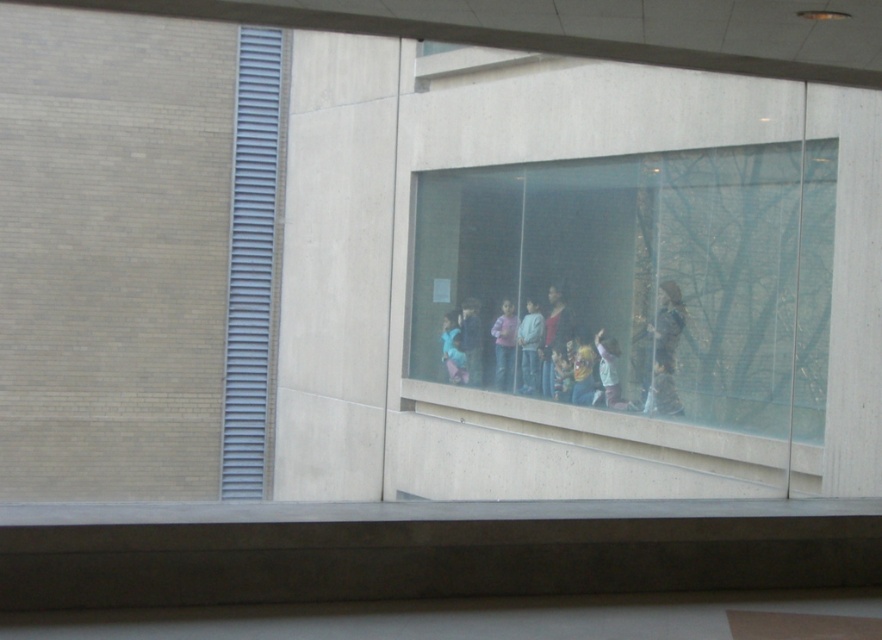
Question: Which point is closer to the camera taking this photo?

Choices:
 (A) (467, 369)
 (B) (528, 332)
 (C) (606, 397)

Answer: (C)

Question: Which point is closer to the camera?

Choices:
 (A) blue denim jeans at center
 (B) matte pink sweater at center

Answer: (B)

Question: Is transparent glass window at center further to camera compared to multicolored clothing at center?

Choices:
 (A) yes
 (B) no

Answer: (B)

Question: Among these objects, which one is farthest from the camera?

Choices:
 (A) multicolored clothing at center
 (B) light blue fabric at center
 (C) light green fabric shirt at center
 (D) striped sweater at center

Answer: (D)

Question: Does transparent glass window at center have a greater width compared to matte pink sweater at center?

Choices:
 (A) yes
 (B) no

Answer: (A)

Question: Is light blue fabric at center thinner than light green fabric shirt at center?

Choices:
 (A) no
 (B) yes

Answer: (A)